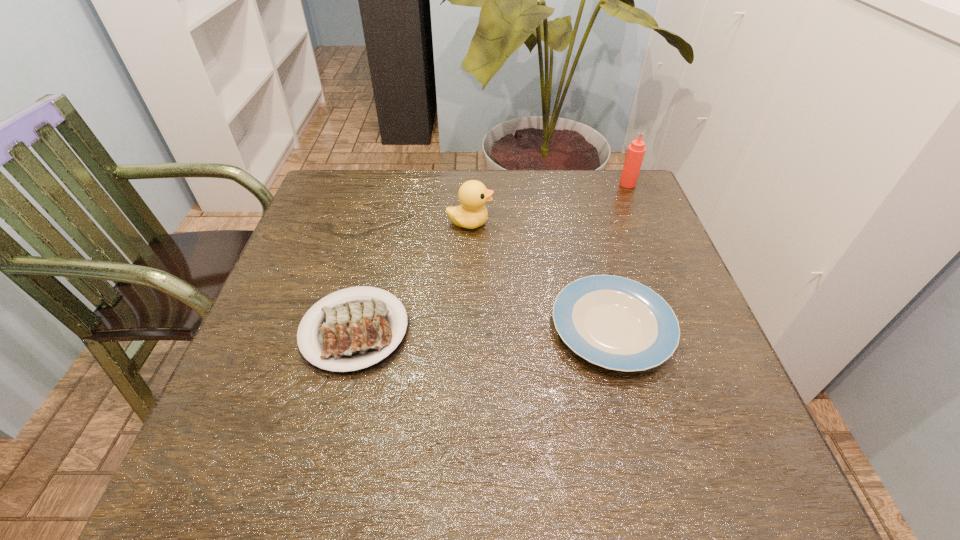
Identify the location of the rightmost object. The width and height of the screenshot is (960, 540). (636, 150).

You are a GUI agent. You are given a task and a screenshot of the screen. Output one action in this format:
    pyautogui.click(x=<x>, y=<y>)
    Task: Click on the Tabasco sauce
    This screenshot has height=540, width=960.
    Given the screenshot: What is the action you would take?
    pyautogui.click(x=636, y=150)

The image size is (960, 540). Find the location of `the second farthest object`. the second farthest object is located at coordinates (473, 195).

Locate an element on the screen. Image resolution: width=960 pixels, height=540 pixels. the second object from left to right is located at coordinates (473, 195).

Image resolution: width=960 pixels, height=540 pixels. Identify the location of the left plate. (353, 333).

Locate an element on the screen. This screenshot has height=540, width=960. the right plate is located at coordinates (617, 323).

The height and width of the screenshot is (540, 960). Find the location of `vacant area situated 0.280m on the left of the farthest object`. vacant area situated 0.280m on the left of the farthest object is located at coordinates (522, 184).

This screenshot has width=960, height=540. Find the location of `free space located on the face of the duck`. free space located on the face of the duck is located at coordinates (602, 223).

Find the location of `free space located 0.390m on the right of the left plate`. free space located 0.390m on the right of the left plate is located at coordinates (611, 330).

Where is `blank space located 0.400m on the left of the second object from right to left`? blank space located 0.400m on the left of the second object from right to left is located at coordinates (354, 328).